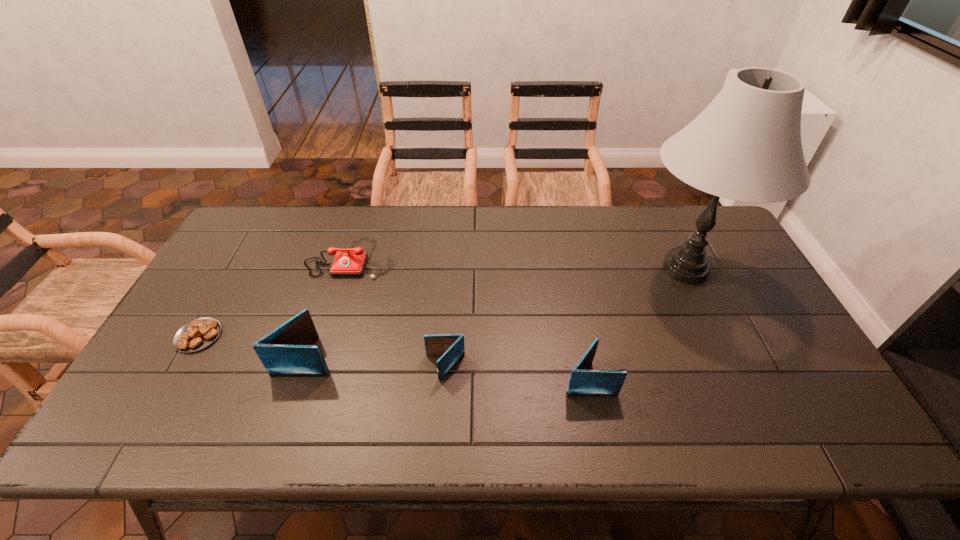
You are a GUI agent. You are given a task and a screenshot of the screen. Output one action in this format:
    pyautogui.click(x=<x>, y=<y>)
    Task: Click on the shortest object
    The width and height of the screenshot is (960, 540).
    Given the screenshot: What is the action you would take?
    coord(199,333)

Where is `vacant space located 0.170m on the exterior surface of the leftmost wallet`? vacant space located 0.170m on the exterior surface of the leftmost wallet is located at coordinates (x=402, y=357).

This screenshot has height=540, width=960. Find the location of `free location located on the exterior surface of the shortest wallet`. free location located on the exterior surface of the shortest wallet is located at coordinates (309, 367).

I want to click on free space located 0.290m on the exterior surface of the shortest wallet, so click(309, 367).

Locate an element on the screen. The height and width of the screenshot is (540, 960). vacant space located on the exterior surface of the shortest wallet is located at coordinates (294, 367).

Locate an element on the screen. This screenshot has width=960, height=540. vacant region located on the exterior surface of the second shortest wallet is located at coordinates (679, 378).

This screenshot has height=540, width=960. Find the location of `free space located on the dial of the telephone`. free space located on the dial of the telephone is located at coordinates (333, 319).

Identify the location of free region located on the front of the tallest object. (741, 387).

This screenshot has width=960, height=540. Find the location of `vacant space located 0.190m on the right of the pastry`. vacant space located 0.190m on the right of the pastry is located at coordinates (292, 336).

I want to click on telephone that is positioned at the far edge, so click(351, 262).